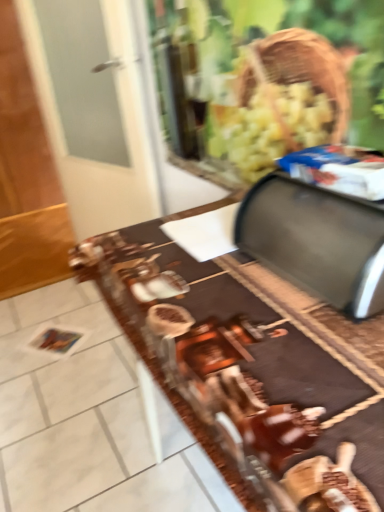
Question: Is satin silver breadbox at upper right behind brown glossy table at center?

Choices:
 (A) yes
 (B) no

Answer: (A)

Question: From a real-world perspective, is satin silver breadbox at upper right below brown glossy table at center?

Choices:
 (A) yes
 (B) no

Answer: (B)

Question: From the image's perspective, would you say satin silver breadbox at upper right is shown under brown glossy table at center?

Choices:
 (A) no
 (B) yes

Answer: (A)

Question: Is satin silver breadbox at upper right positioned with its back to brown glossy table at center?

Choices:
 (A) yes
 (B) no

Answer: (B)

Question: Can brown glossy table at center be found inside satin silver breadbox at upper right?

Choices:
 (A) yes
 (B) no

Answer: (B)

Question: Considering the relative sizes of satin silver breadbox at upper right and brown glossy table at center in the image provided, is satin silver breadbox at upper right wider than brown glossy table at center?

Choices:
 (A) no
 (B) yes

Answer: (A)

Question: From a real-world perspective, is brown glossy table at center on satin silver breadbox at upper right?

Choices:
 (A) no
 (B) yes

Answer: (A)

Question: Can we say brown glossy table at center lies outside satin silver breadbox at upper right?

Choices:
 (A) no
 (B) yes

Answer: (B)

Question: Is brown glossy table at center shorter than satin silver breadbox at upper right?

Choices:
 (A) no
 (B) yes

Answer: (A)

Question: Is brown glossy table at center beside satin silver breadbox at upper right?

Choices:
 (A) yes
 (B) no

Answer: (B)

Question: From the image's perspective, is brown glossy table at center on top of satin silver breadbox at upper right?

Choices:
 (A) no
 (B) yes

Answer: (A)

Question: Does brown glossy table at center have a lesser width compared to satin silver breadbox at upper right?

Choices:
 (A) no
 (B) yes

Answer: (A)

Question: Considering the relative positions of brown glossy table at center and satin silver breadbox at upper right in the image provided, is brown glossy table at center to the left or to the right of satin silver breadbox at upper right?

Choices:
 (A) right
 (B) left

Answer: (B)